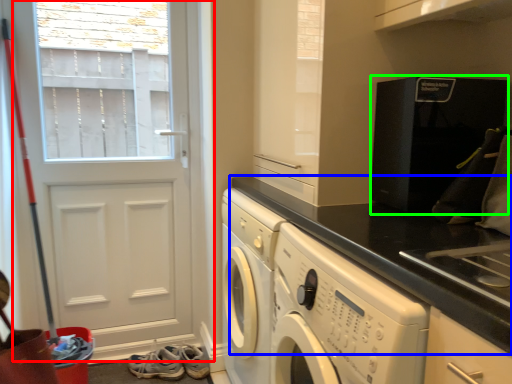
Question: Which object is the farthest from door (highlighted by a red box)? Choose among these: countertop (highlighted by a blue box) or home appliance (highlighted by a green box).

Choices:
 (A) countertop
 (B) home appliance

Answer: (B)